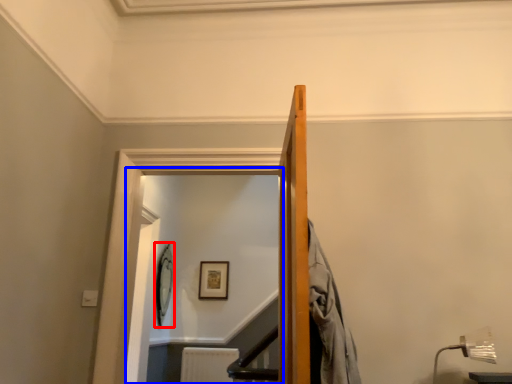
Question: Which object is further to the camera taking this photo, picture frame (highlighted by a red box) or glass door (highlighted by a blue box)?

Choices:
 (A) picture frame
 (B) glass door

Answer: (A)